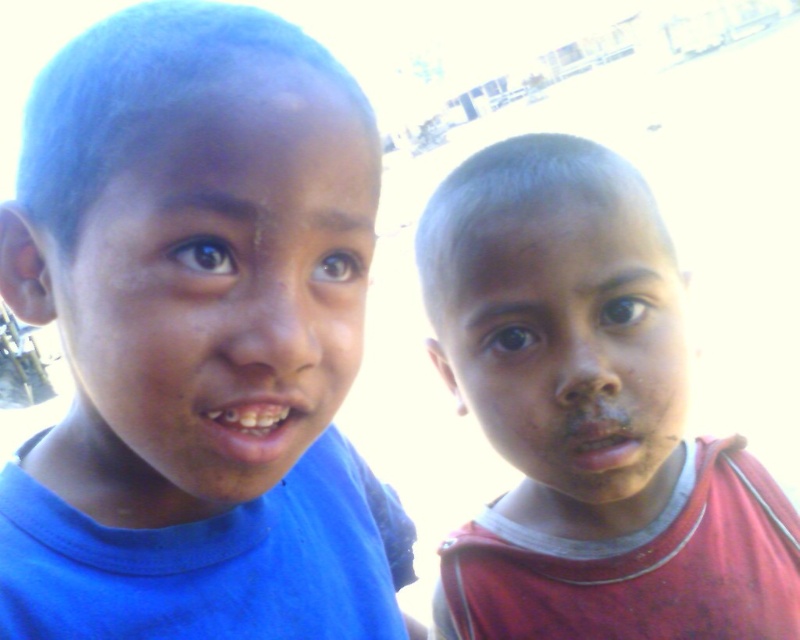
You are a photographer trying to capture a clear photo of the dull skin face at right without the matte red shirt at right blocking it. Based on their sizes, is it possible to adjust your camera angle to achieve this?

The matte red shirt at right has a larger size compared to dull skin face at right, so adjusting the camera angle might be challenging but possible by zooming in or moving closer to focus on the smaller dull skin face at right while avoiding the larger matte red shirt at right.

Looking at this image, you are holding a camera and want to take a photo of the two children. The camera has a focus range of 15 inches. Can you focus on the point at point (216, 252)?

The point at point (216, 252) is 14.92 inches from the camera, which is within the focus range of 15 inches. Therefore, the camera can focus on the point at point (216, 252).

You are holding a small toy that is 12 inches long. You want to place it on the ground so that it reaches from your current position to the point at point (48, 64). Is the distance sufficient?

The point at point (48, 64) is 17.22 inches from the viewer, which is longer than the 12 inch toy. Therefore, the toy is not long enough to reach that point.